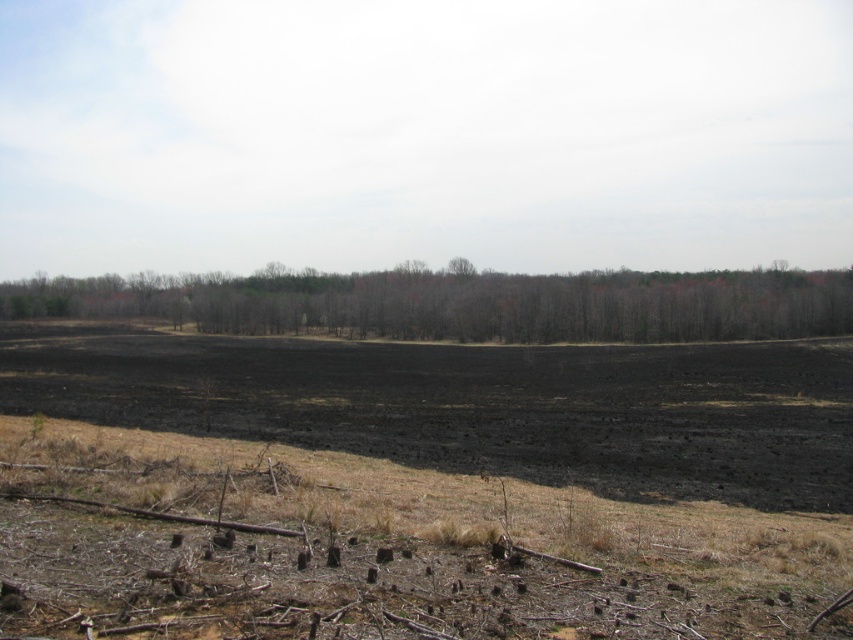
Measure the distance between point (250, 605) and camera.

A distance of 4.80 meters exists between point (250, 605) and camera.

Does point (206, 561) come closer to viewer compared to point (749, 310)?

Yes, it is in front of point (749, 310).

Between point (631, 483) and point (631, 308), which one is positioned behind?

Positioned behind is point (631, 308).

Image resolution: width=853 pixels, height=640 pixels. I want to click on black soil at center, so click(x=419, y=486).